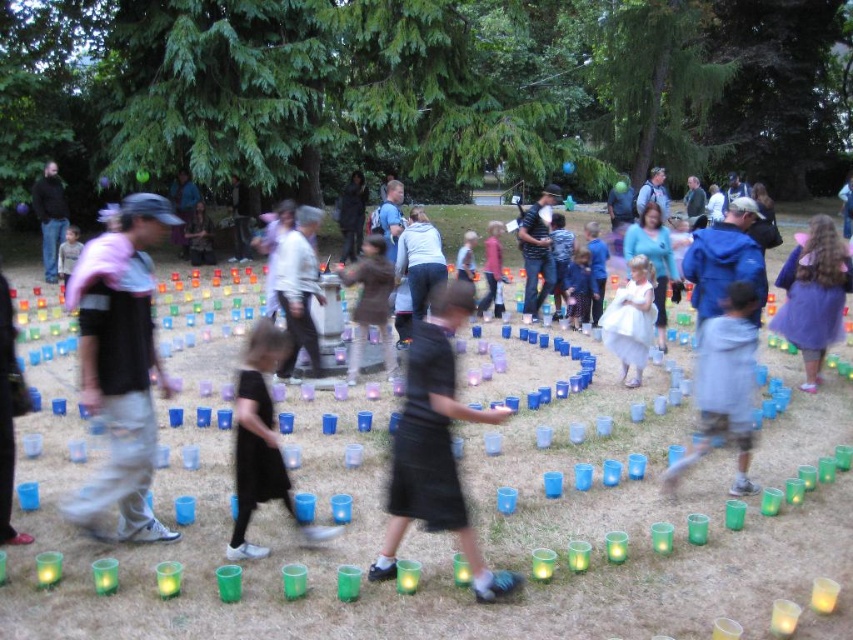
Question: Is light gray distressed jeans at left below black matte skirt at center?

Choices:
 (A) yes
 (B) no

Answer: (B)

Question: Which point appears closest to the camera in this image?

Choices:
 (A) (64, 304)
 (B) (421, 433)

Answer: (B)

Question: From the image, what is the correct spatial relationship of light gray distressed jeans at left in relation to black matte skirt at center?

Choices:
 (A) left
 (B) right

Answer: (A)

Question: Which of the following is the closest to the observer?

Choices:
 (A) light gray distressed jeans at left
 (B) black matte skirt at center

Answer: (B)

Question: Does light gray distressed jeans at left lie behind black matte skirt at center?

Choices:
 (A) yes
 (B) no

Answer: (A)